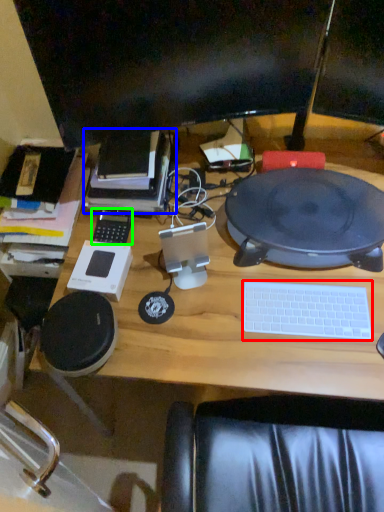
Question: Based on their relative distances, which object is nearer to computer keyboard (highlighted by a red box)? Choose from book (highlighted by a blue box) and gadget (highlighted by a green box).

Choices:
 (A) book
 (B) gadget

Answer: (A)